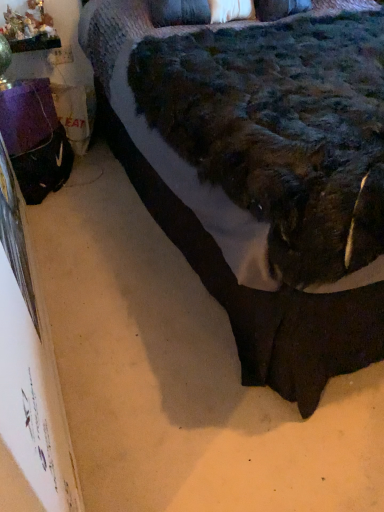
Where is `velvet dark green bed at center`? This screenshot has height=512, width=384. velvet dark green bed at center is located at coordinates (259, 169).

What do you see at coordinates (259, 169) in the screenshot? This screenshot has width=384, height=512. I see `velvet dark green bed at center` at bounding box center [259, 169].

Find the location of a particular element. Image resolution: width=384 pixels, height=512 pixels. velvet dark green bed at center is located at coordinates (259, 169).